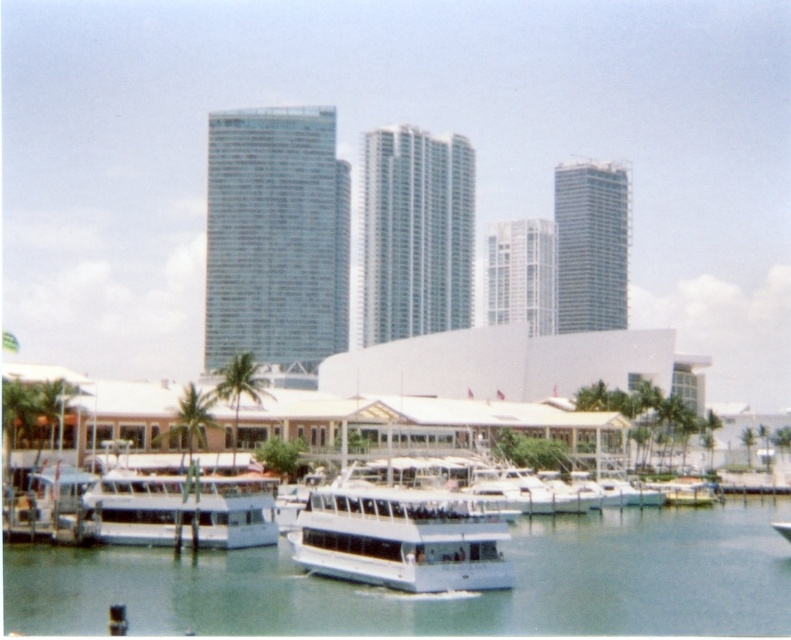
You are a tour guide leading a group to a boat at the waterfront. The boat you want to board is the white glossy boat at lower left. However, there is a green leafy palm tree at lower left blocking the path. Can you walk around the palm tree to reach the boat?

The white glossy boat at lower left is 16.75 meters away from the green leafy palm tree at lower left. Since the distance between them is significant, you can easily walk around the palm tree to reach the boat.

You are a passenger on the white glossy boat at center and want to see the clear water at center. In which direction should you look from your current position?

The clear water at center is below the white glossy boat at center, so you should look downward to see the clear water at center.